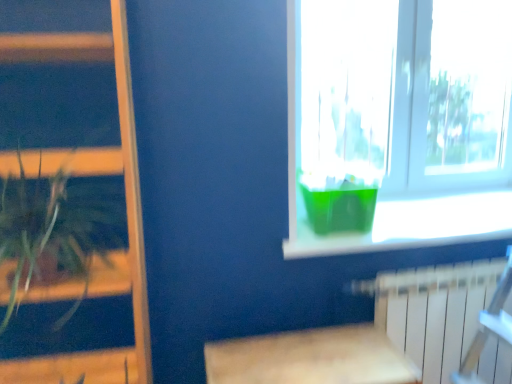
The image size is (512, 384). Describe the element at coordinates (78, 203) in the screenshot. I see `wooden bookshelf at left` at that location.

This screenshot has width=512, height=384. What do you see at coordinates (54, 221) in the screenshot?
I see `green leafy plant at left` at bounding box center [54, 221].

The height and width of the screenshot is (384, 512). Identify the location of green translucent vase at window. (338, 205).

This screenshot has width=512, height=384. Identify the location of bookshelf directly beneath the transparent plastic container at upper right (from a real-world perspective). (78, 203).

From a real-world perspective, which is physically above, transparent plastic container at upper right or wooden bookshelf at left?

transparent plastic container at upper right, from a real-world perspective.

Would you say transparent plastic container at upper right is a long distance from wooden bookshelf at left?

Indeed, transparent plastic container at upper right is not near wooden bookshelf at left.

Who is smaller, transparent plastic container at upper right or wooden bookshelf at left?

transparent plastic container at upper right is smaller.

Considering the sizes of transparent plastic container at upper right and green leafy plant at left in the image, is transparent plastic container at upper right taller or shorter than green leafy plant at left?

transparent plastic container at upper right is taller than green leafy plant at left.

Is transparent plastic container at upper right wider or thinner than green leafy plant at left?

transparent plastic container at upper right is thinner than green leafy plant at left.

Where is `houseplant in front of the transparent plastic container at upper right`? This screenshot has height=384, width=512. houseplant in front of the transparent plastic container at upper right is located at coordinates (54, 221).

From a real-world perspective, does green translucent vase at window sit lower than wooden bookshelf at left?

No, from a real-world perspective, green translucent vase at window is not under wooden bookshelf at left.

Is green translucent vase at window taller than wooden bookshelf at left?

In fact, green translucent vase at window may be shorter than wooden bookshelf at left.

Is green translucent vase at window far from wooden bookshelf at left?

No, green translucent vase at window is not far from wooden bookshelf at left.

Is wooden bookshelf at left at the back of green translucent vase at window?

That's not correct — green translucent vase at window is not looking away from wooden bookshelf at left.

From a real-world perspective, is green plastic container at upper right positioned over green leafy plant at left based on gravity?

No, from a real-world perspective, green plastic container at upper right is not above green leafy plant at left.

Between point (344, 249) and point (88, 241), which one is positioned in front?

The point (88, 241) is closer.

Considering the positions of objects green plastic container at upper right and green leafy plant at left in the image provided, who is behind, green plastic container at upper right or green leafy plant at left?

green plastic container at upper right is further away from the camera.

The width and height of the screenshot is (512, 384). Find the location of `window sill located underneath the green leafy plant at left (from a real-world perspective)`. window sill located underneath the green leafy plant at left (from a real-world perspective) is located at coordinates (414, 225).

How much distance is there between transparent plastic container at upper right and green translucent vase at window?

A distance of 17.64 inches exists between transparent plastic container at upper right and green translucent vase at window.

Would you say transparent plastic container at upper right is to the left or to the right of green translucent vase at window in the picture?

Based on their positions, transparent plastic container at upper right is located to the right of green translucent vase at window.

Is transparent plastic container at upper right taller or shorter than green translucent vase at window?

Clearly, transparent plastic container at upper right is taller compared to green translucent vase at window.

Is point (450, 9) less distant than point (366, 227)?

No, (450, 9) is further to viewer.

Which of these two, green translucent vase at window or white plastic radiator at lower right, is bigger?

white plastic radiator at lower right.

Which is nearer, (x=323, y=229) or (x=408, y=294)?

Point (x=323, y=229) appears to be farther away from the viewer than point (x=408, y=294).

Is the position of green translucent vase at window more distant than that of white plastic radiator at lower right?

Yes, green translucent vase at window is behind white plastic radiator at lower right.

From a real-world perspective, is green translucent vase at window above or below white plastic radiator at lower right?

From a real-world perspective, green translucent vase at window is physically above white plastic radiator at lower right.

Is transparent plastic container at upper right positioned with its back to white plastic radiator at lower right?

No, transparent plastic container at upper right is not facing away from white plastic radiator at lower right.

Is transparent plastic container at upper right shorter than white plastic radiator at lower right?

Incorrect, the height of transparent plastic container at upper right does not fall short of that of white plastic radiator at lower right.

Which is farther, (332, 21) or (405, 324)?

The point (332, 21) is farther.

Find the location of a particular element. The image size is (512, 384). bookshelf in front of the transparent plastic container at upper right is located at coordinates (78, 203).

Find the location of a particular element. window behind the green leafy plant at left is located at coordinates (400, 120).

Looking at the image, which one is located further to green leafy plant at left, wooden bookshelf at left or transparent plastic container at upper right?

transparent plastic container at upper right lies further to green leafy plant at left than the other object.

From the image, which object appears to be farther from wooden bookshelf at left, green translucent vase at window or green leafy plant at left?

green translucent vase at window is further to wooden bookshelf at left.

Estimate the real-world distances between objects in this image. Which object is closer to white plastic radiator at lower right, transparent plastic container at upper right or wooden bookshelf at left?

transparent plastic container at upper right lies closer to white plastic radiator at lower right than the other object.

Which object lies further to the anchor point transparent plastic container at upper right, wooden bookshelf at left or green translucent vase at window?

The object further to transparent plastic container at upper right is wooden bookshelf at left.

Looking at the image, which one is located further to wooden table at lower center, green translucent vase at window or white plastic radiator at lower right?

Among the two, green translucent vase at window is located further to wooden table at lower center.

Consider the image. Looking at the image, which one is located further to transparent plastic container at upper right, white plastic radiator at lower right or green plastic container at upper right?

Based on the image, white plastic radiator at lower right appears to be further to transparent plastic container at upper right.

Which object lies nearer to the anchor point green translucent vase at window, green leafy plant at left or green plastic container at upper right?

Among the two, green plastic container at upper right is located nearer to green translucent vase at window.

From the image, which object appears to be nearer to green translucent vase at window, wooden table at lower center or transparent plastic container at upper right?

transparent plastic container at upper right is positioned closer to the anchor green translucent vase at window.

The width and height of the screenshot is (512, 384). Find the location of `table between green leafy plant at left and white plastic radiator at lower right in the horizontal direction`. table between green leafy plant at left and white plastic radiator at lower right in the horizontal direction is located at coordinates (311, 358).

You are a GUI agent. You are given a task and a screenshot of the screen. Output one action in this format:
    pyautogui.click(x=<x>, y=<y>)
    Task: Click on the radiator between green leafy plant at left and transparent plastic container at upper right from left to right
    This screenshot has width=512, height=384.
    Given the screenshot: What is the action you would take?
    pyautogui.click(x=433, y=311)

At what (x,y) coordinates should I click in order to perform the action: click on glass vase located between green leafy plant at left and green plastic container at upper right in the left-right direction. Please return your answer as a coordinate pair (x, y). This screenshot has height=384, width=512. Looking at the image, I should click on (338, 205).

Locate an element on the screen. This screenshot has width=512, height=384. window sill located between wooden bookshelf at left and transparent plastic container at upper right in the left-right direction is located at coordinates (414, 225).